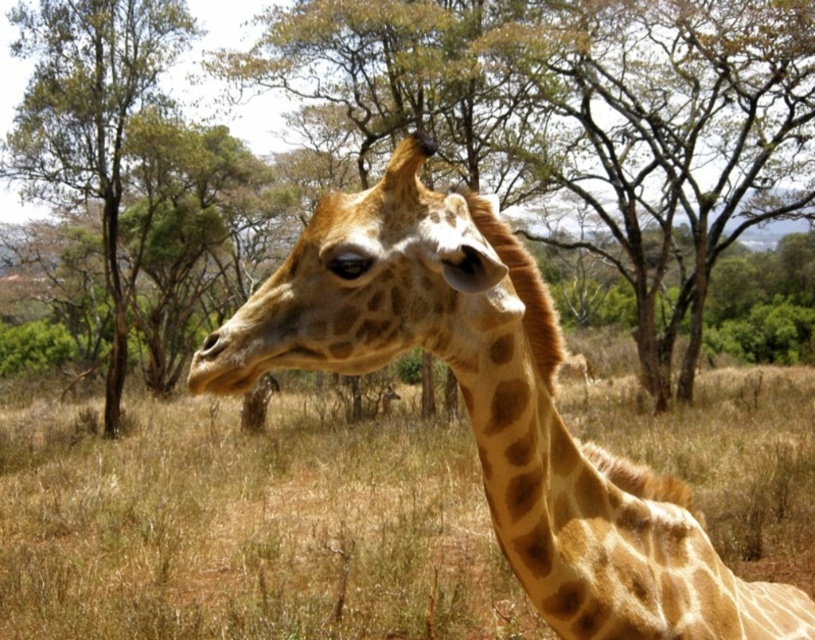
Can you confirm if brown dry grass at center is positioned below spotted fur giraffe at center?

Indeed, brown dry grass at center is positioned under spotted fur giraffe at center.

Is brown dry grass at center positioned at the back of spotted fur giraffe at center?

That is True.

This screenshot has width=815, height=640. In order to click on brown dry grass at center in this screenshot , I will do `click(249, 529)`.

Where is `brown dry grass at center`? This screenshot has width=815, height=640. brown dry grass at center is located at coordinates (249, 529).

Can you confirm if spotted fur giraffe at center is positioned below brown wood tree at center?

Yes, spotted fur giraffe at center is below brown wood tree at center.

Is spotted fur giraffe at center positioned in front of brown wood tree at center?

Yes, spotted fur giraffe at center is closer to the viewer.

What do you see at coordinates (496, 406) in the screenshot?
I see `spotted fur giraffe at center` at bounding box center [496, 406].

At what (x,y) coordinates should I click in order to perform the action: click on spotted fur giraffe at center. Please return your answer as a coordinate pair (x, y). The image size is (815, 640). Looking at the image, I should click on (496, 406).

Is spotted fur giraffe at center closer to camera compared to brown textured tree at center?

Yes, spotted fur giraffe at center is closer to the viewer.

Who is lower down, spotted fur giraffe at center or brown textured tree at center?

spotted fur giraffe at center is lower down.

Is point (397, 172) positioned in front of point (42, 168)?

Yes, point (397, 172) is closer to viewer.

I want to click on spotted fur giraffe at center, so click(x=496, y=406).